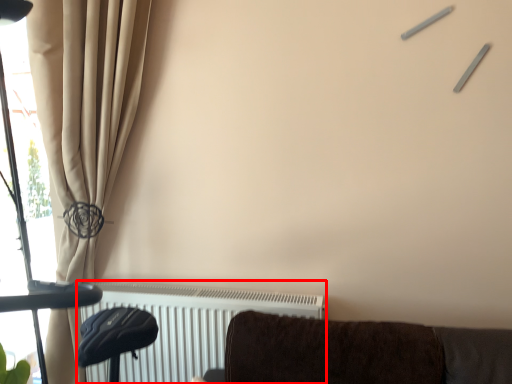
Question: From the image's perspective, what is the correct spatial positioning of radiator (annotated by the red box) in reference to curtain?

Choices:
 (A) above
 (B) below

Answer: (B)